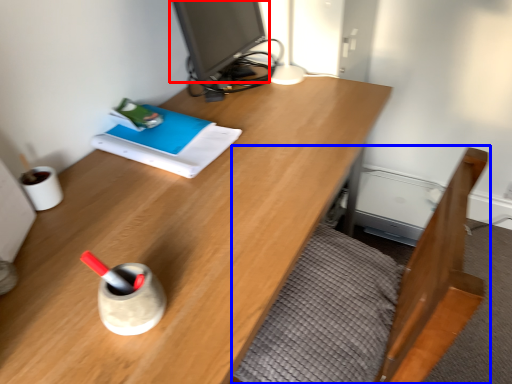
Question: Which point is closer to the camera, computer monitor (highlighted by a red box) or bed frame (highlighted by a blue box)?

Choices:
 (A) computer monitor
 (B) bed frame

Answer: (B)